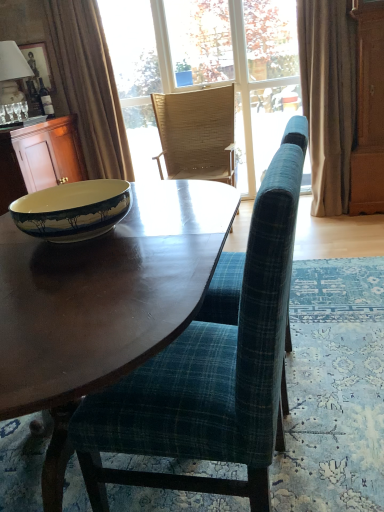
Question: Is plaid fabric chair at center, which ranks as the second chair in back-to-front order, next to matte glass bottle at upper left and touching it?

Choices:
 (A) yes
 (B) no

Answer: (B)

Question: Can you confirm if plaid fabric chair at center, which is the first chair from bottom to top, is positioned to the right of matte glass bottle at upper left?

Choices:
 (A) no
 (B) yes

Answer: (B)

Question: From a real-world perspective, is plaid fabric chair at center, which is the second chair in top-to-bottom order, under matte glass bottle at upper left?

Choices:
 (A) no
 (B) yes

Answer: (B)

Question: Considering the relative sizes of plaid fabric chair at center, which is the second chair in top-to-bottom order, and matte glass bottle at upper left in the image provided, is plaid fabric chair at center, which is the second chair in top-to-bottom order, taller than matte glass bottle at upper left?

Choices:
 (A) yes
 (B) no

Answer: (A)

Question: Is plaid fabric chair at center, which is the second chair in top-to-bottom order, positioned far away from matte glass bottle at upper left?

Choices:
 (A) no
 (B) yes

Answer: (B)

Question: Is plaid fabric chair at center, which is the second chair in top-to-bottom order, looking in the opposite direction of matte glass bottle at upper left?

Choices:
 (A) no
 (B) yes

Answer: (A)

Question: Is matte glass bottle at upper left next to wooden picture frame at upper left?

Choices:
 (A) no
 (B) yes

Answer: (A)

Question: Considering the relative sizes of matte glass bottle at upper left and wooden picture frame at upper left in the image provided, is matte glass bottle at upper left smaller than wooden picture frame at upper left?

Choices:
 (A) no
 (B) yes

Answer: (B)

Question: Is wooden picture frame at upper left at the back of matte glass bottle at upper left?

Choices:
 (A) yes
 (B) no

Answer: (B)

Question: Is matte glass bottle at upper left closer to camera compared to wooden picture frame at upper left?

Choices:
 (A) no
 (B) yes

Answer: (B)

Question: From the image's perspective, is matte glass bottle at upper left on top of wooden picture frame at upper left?

Choices:
 (A) yes
 (B) no

Answer: (B)

Question: Considering the relative sizes of matte glass bottle at upper left and wooden picture frame at upper left in the image provided, is matte glass bottle at upper left thinner than wooden picture frame at upper left?

Choices:
 (A) no
 (B) yes

Answer: (A)

Question: Does white fabric lampshade at upper left lie behind matte glass bottle at upper left?

Choices:
 (A) no
 (B) yes

Answer: (A)